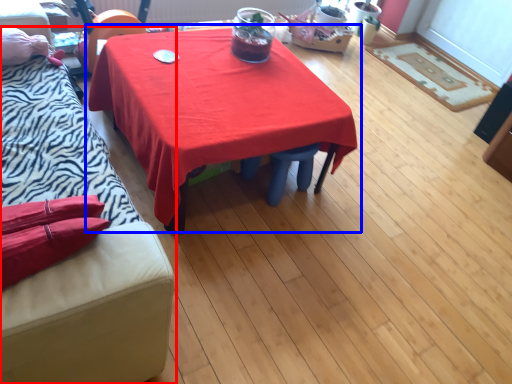
Question: Which point is further to the camera, studio couch (highlighted by a red box) or table (highlighted by a blue box)?

Choices:
 (A) studio couch
 (B) table

Answer: (B)